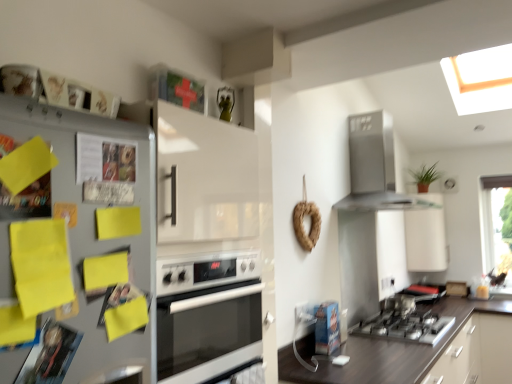
Question: Should I look upward or downward to see white glossy cabinet at upper right?

Choices:
 (A) up
 (B) down

Answer: (B)

Question: Is satin silver range hood at upper right not within transparent glass window at upper right?

Choices:
 (A) no
 (B) yes

Answer: (B)

Question: Is satin silver range hood at upper right to the right of transparent glass window at upper right from the viewer's perspective?

Choices:
 (A) yes
 (B) no

Answer: (B)

Question: From the image's perspective, is satin silver range hood at upper right located beneath transparent glass window at upper right?

Choices:
 (A) no
 (B) yes

Answer: (A)

Question: From a real-world perspective, is satin silver range hood at upper right located higher than transparent glass window at upper right?

Choices:
 (A) yes
 (B) no

Answer: (A)

Question: Is satin silver range hood at upper right surrounding transparent glass window at upper right?

Choices:
 (A) yes
 (B) no

Answer: (B)

Question: Is satin silver range hood at upper right positioned behind transparent glass window at upper right?

Choices:
 (A) no
 (B) yes

Answer: (A)

Question: Is transparent glass window at upper right outside white glossy oven at center?

Choices:
 (A) yes
 (B) no

Answer: (A)

Question: From a real-world perspective, is transparent glass window at upper right located beneath white glossy oven at center?

Choices:
 (A) yes
 (B) no

Answer: (B)

Question: Is transparent glass window at upper right to the left of white glossy oven at center from the viewer's perspective?

Choices:
 (A) yes
 (B) no

Answer: (B)

Question: From the image's perspective, does transparent glass window at upper right appear higher than white glossy oven at center?

Choices:
 (A) yes
 (B) no

Answer: (A)

Question: Is transparent glass window at upper right at the right side of white glossy oven at center?

Choices:
 (A) no
 (B) yes

Answer: (B)

Question: Does transparent glass window at upper right have a greater width compared to white glossy oven at center?

Choices:
 (A) no
 (B) yes

Answer: (A)

Question: Can you confirm if transparent glass window at upper right is positioned to the left of satin silver range hood at upper right?

Choices:
 (A) yes
 (B) no

Answer: (B)